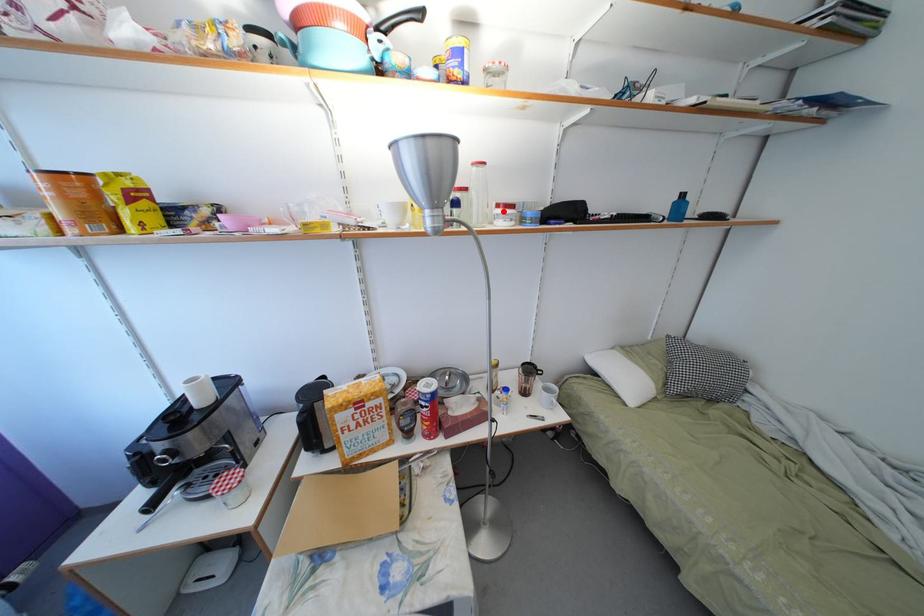
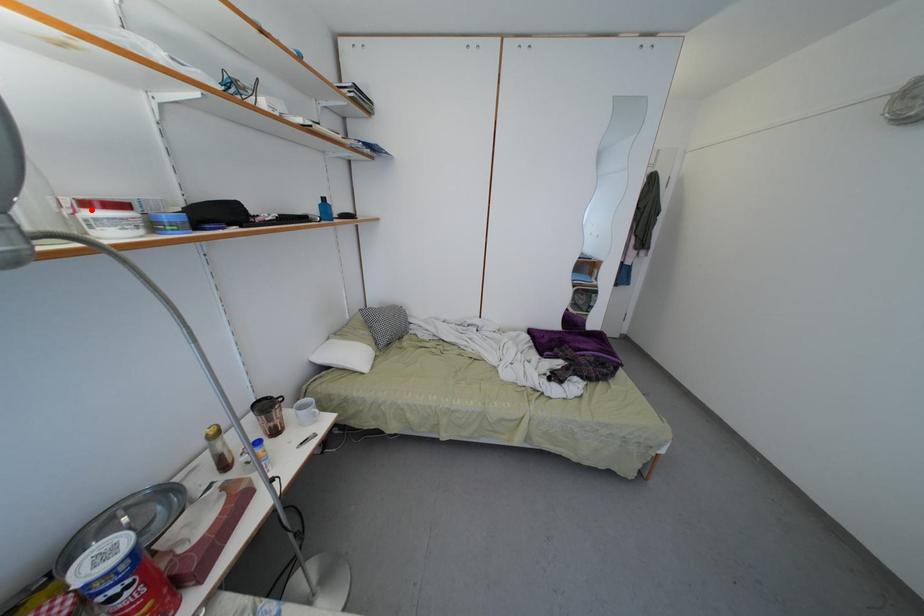
I am providing you with two images of the same scene from different viewpoints. A red point is marked on the first image and another point is marked on the second image. Is the marked point in image1 the same physical position as the marked point in image2?

Yes